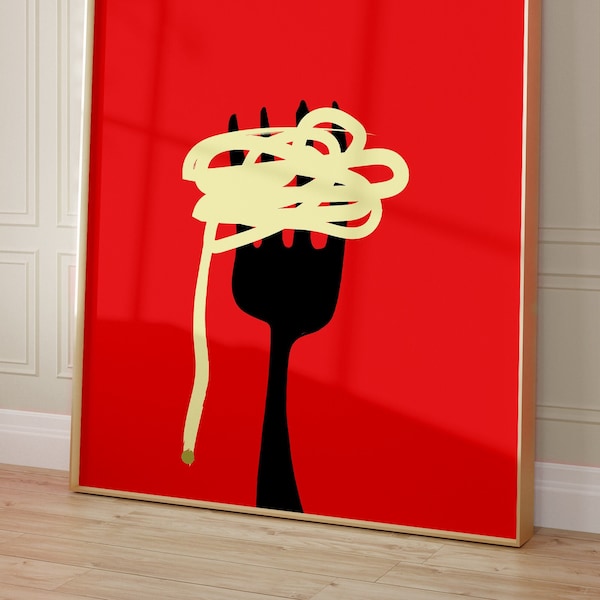
Find the location of a particular element. This screenshot has width=600, height=600. floor is located at coordinates (118, 538).